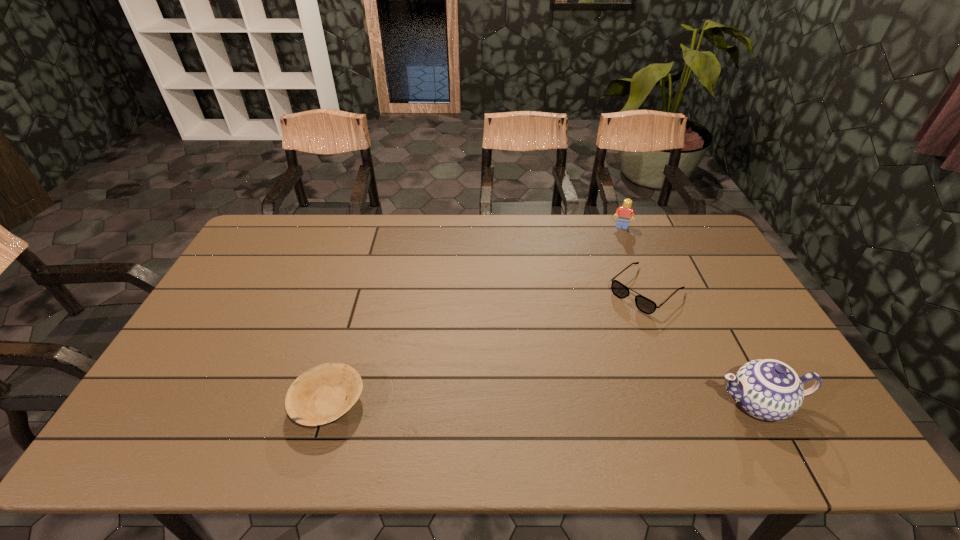
At what (x,y) coordinates should I click in order to perform the action: click on bowl. Please return your answer as a coordinate pair (x, y). The image size is (960, 540). Looking at the image, I should click on (x=318, y=396).

The image size is (960, 540). Identify the location of the tallest object. (768, 389).

Where is `spectacles`? spectacles is located at coordinates (645, 305).

Find the location of a particular element. This screenshot has height=540, width=960. the farthest object is located at coordinates (624, 213).

Locate an element on the screen. the second tallest object is located at coordinates (624, 213).

Where is `free space located 0.120m on the back of the bowl`? This screenshot has height=540, width=960. free space located 0.120m on the back of the bowl is located at coordinates (348, 339).

Where is `vacant region located 0.370m at the spout of the tallest object`? Image resolution: width=960 pixels, height=540 pixels. vacant region located 0.370m at the spout of the tallest object is located at coordinates (560, 403).

Where is `vacant space situated 0.130m at the spout of the tallest object`? vacant space situated 0.130m at the spout of the tallest object is located at coordinates (657, 403).

In order to click on free space located at the spout of the tallest object in this screenshot , I will do `click(636, 403)`.

Where is `vacant space located on the front-facing side of the second farthest object`? vacant space located on the front-facing side of the second farthest object is located at coordinates pos(610,322).